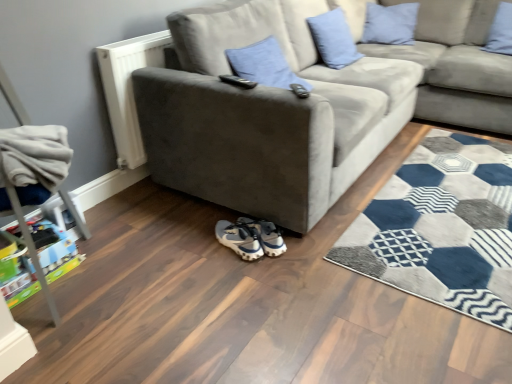
Question: Considering the relative sizes of black plastic remote control at upper center, acting as the 1th remote control starting from the left, and white fabric sneakers at lower center, positioned as the 1th footwear in right-to-left order, in the image provided, is black plastic remote control at upper center, acting as the 1th remote control starting from the left, wider than white fabric sneakers at lower center, positioned as the 1th footwear in right-to-left order,?

Choices:
 (A) yes
 (B) no

Answer: (B)

Question: Can you confirm if black plastic remote control at upper center, acting as the 1th remote control starting from the left, is thinner than white fabric sneakers at lower center, the second footwear positioned from the left?

Choices:
 (A) no
 (B) yes

Answer: (B)

Question: Considering the relative positions of black plastic remote control at upper center, acting as the 1th remote control starting from the left, and white fabric sneakers at lower center, positioned as the 1th footwear in right-to-left order, in the image provided, is black plastic remote control at upper center, acting as the 1th remote control starting from the left, in front of white fabric sneakers at lower center, positioned as the 1th footwear in right-to-left order,?

Choices:
 (A) yes
 (B) no

Answer: (A)

Question: Is black plastic remote control at upper center, the second remote control in the right-to-left sequence, smaller than white fabric sneakers at lower center, the second footwear positioned from the left?

Choices:
 (A) no
 (B) yes

Answer: (B)

Question: Does black plastic remote control at upper center, acting as the 1th remote control starting from the left, appear on the right side of white fabric sneakers at lower center, positioned as the 1th footwear in right-to-left order?

Choices:
 (A) yes
 (B) no

Answer: (B)

Question: From a real-world perspective, relative to blue fabric pillow at upper center, the fourth pillow viewed from the right, is white matte radiator at left vertically above or below?

Choices:
 (A) above
 (B) below

Answer: (B)

Question: From their relative heights in the image, would you say white matte radiator at left is taller or shorter than blue fabric pillow at upper center, the fourth pillow viewed from the right?

Choices:
 (A) short
 (B) tall

Answer: (B)

Question: Is white matte radiator at left in front of or behind blue fabric pillow at upper center, arranged as the first pillow when viewed from the left, in the image?

Choices:
 (A) behind
 (B) front

Answer: (B)

Question: From the image's perspective, relative to blue fabric pillow at upper center, the fourth pillow viewed from the right, is white matte radiator at left above or below?

Choices:
 (A) below
 (B) above

Answer: (A)

Question: Is blue velvet pillow at upper right, the fourth pillow in the left-to-right sequence, inside the boundaries of suede gray couch at upper right, or outside?

Choices:
 (A) inside
 (B) outside

Answer: (A)

Question: Is point (508, 8) closer or farther from the camera than point (486, 81)?

Choices:
 (A) closer
 (B) farther

Answer: (B)

Question: From the image's perspective, relative to suede gray couch at upper right, is blue velvet pillow at upper right, the 1th pillow in the right-to-left sequence, above or below?

Choices:
 (A) above
 (B) below

Answer: (A)

Question: Considering the positions of blue velvet pillow at upper right, the fourth pillow in the left-to-right sequence, and suede gray couch at upper right in the image, is blue velvet pillow at upper right, the fourth pillow in the left-to-right sequence, bigger or smaller than suede gray couch at upper right?

Choices:
 (A) big
 (B) small

Answer: (B)

Question: From the image's perspective, is black plastic remote control at upper center, the second remote control in the right-to-left sequence, above or below light blue fabric pillow at upper center, positioned as the 2th pillow in right-to-left order?

Choices:
 (A) below
 (B) above

Answer: (A)

Question: Considering the relative positions of black plastic remote control at upper center, acting as the 1th remote control starting from the left, and light blue fabric pillow at upper center, positioned as the 2th pillow in right-to-left order, in the image provided, is black plastic remote control at upper center, acting as the 1th remote control starting from the left, to the left or to the right of light blue fabric pillow at upper center, positioned as the 2th pillow in right-to-left order,?

Choices:
 (A) right
 (B) left

Answer: (B)